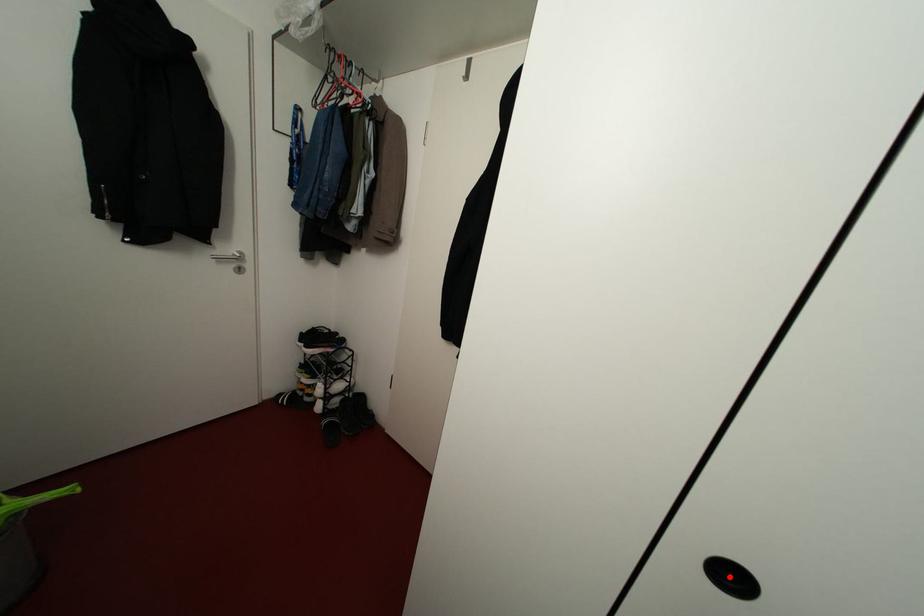
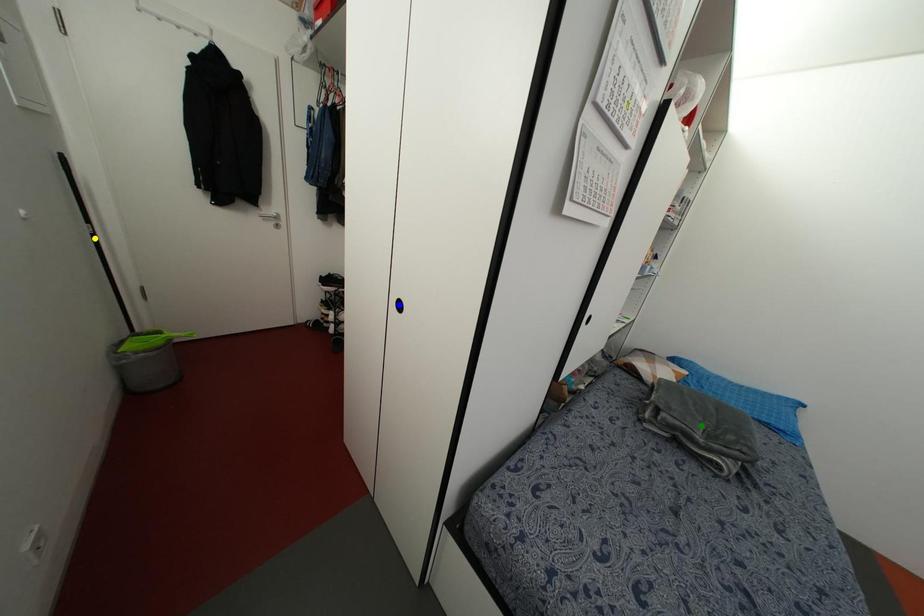
Question: I am providing you with two images of the same scene from different viewpoints. A red point is marked on the first image. You are given multiple points on the second image. Which spot in image 2 lines up with the point in image 1?

Choices:
 (A) yellow point
 (B) green point
 (C) blue point

Answer: (C)